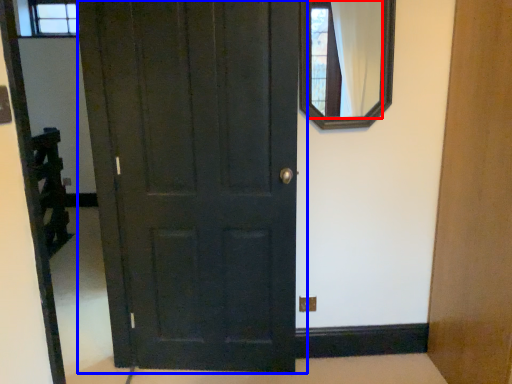
Question: Which of the following is the farthest to the observer, mirror (highlighted by a red box) or door (highlighted by a blue box)?

Choices:
 (A) mirror
 (B) door

Answer: (A)